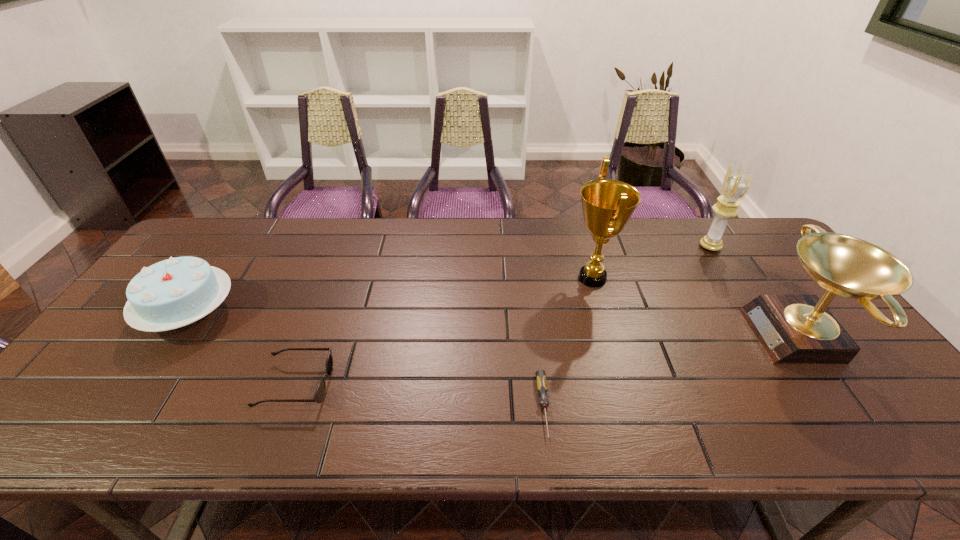
Where is `the fourth object from left to right`? the fourth object from left to right is located at coordinates (607, 204).

Find the location of a particular element. This screenshot has height=540, width=960. the leftmost award is located at coordinates (607, 204).

The width and height of the screenshot is (960, 540). Identify the location of the farthest object. (736, 184).

This screenshot has height=540, width=960. In order to click on the third shortest object in this screenshot , I will do `click(172, 293)`.

Locate an element on the screen. The width and height of the screenshot is (960, 540). birthday cake is located at coordinates (172, 293).

Find the location of `the second object from left to right`. the second object from left to right is located at coordinates (319, 395).

Where is `sunglasses`? This screenshot has width=960, height=540. sunglasses is located at coordinates [319, 395].

The image size is (960, 540). Identify the location of the fourth object from right to left. (541, 381).

I want to click on the shortest object, so click(541, 381).

Find the location of `blank area located 0.270m on the front view with handles of the tallest object`. blank area located 0.270m on the front view with handles of the tallest object is located at coordinates (476, 278).